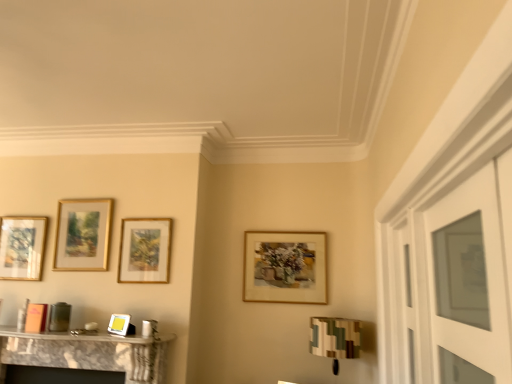
Question: From the image's perspective, is gold/glossy picture frame at upper left, positioned as the second picture frame in left-to-right order, above wooden picture frame at center, the 4th picture frame when ordered from left to right?

Choices:
 (A) no
 (B) yes

Answer: (B)

Question: Is gold/glossy picture frame at upper left, positioned as the second picture frame in left-to-right order, turned away from wooden picture frame at center, the first picture frame positioned from the right?

Choices:
 (A) yes
 (B) no

Answer: (B)

Question: Can you confirm if gold/glossy picture frame at upper left, positioned as the second picture frame in left-to-right order, is wider than wooden picture frame at center, the 4th picture frame when ordered from left to right?

Choices:
 (A) no
 (B) yes

Answer: (A)

Question: Does gold/glossy picture frame at upper left, which is the 3th picture frame from right to left, have a greater height compared to wooden picture frame at center, the first picture frame positioned from the right?

Choices:
 (A) yes
 (B) no

Answer: (B)

Question: Is gold/glossy picture frame at upper left, positioned as the second picture frame in left-to-right order, closer to the viewer compared to wooden picture frame at center, the 4th picture frame when ordered from left to right?

Choices:
 (A) no
 (B) yes

Answer: (B)

Question: Does point (404, 283) appear closer or farther from the camera than point (320, 342)?

Choices:
 (A) closer
 (B) farther

Answer: (A)

Question: Is clear glass door at right taller or shorter than camouflage fabric lampshade at lower right?

Choices:
 (A) short
 (B) tall

Answer: (B)

Question: From a real-world perspective, is clear glass door at right positioned above or below camouflage fabric lampshade at lower right?

Choices:
 (A) below
 (B) above

Answer: (B)

Question: In terms of size, does clear glass door at right appear bigger or smaller than camouflage fabric lampshade at lower right?

Choices:
 (A) big
 (B) small

Answer: (B)

Question: Is gold/glossy picture frame at upper left, positioned as the second picture frame in left-to-right order, wider or thinner than gold-framed picture at left, placed as the fourth picture frame when sorted from right to left?

Choices:
 (A) thin
 (B) wide

Answer: (A)

Question: From the image's perspective, relative to gold-framed picture at left, placed as the fourth picture frame when sorted from right to left, is gold/glossy picture frame at upper left, positioned as the second picture frame in left-to-right order, above or below?

Choices:
 (A) below
 (B) above

Answer: (B)

Question: Is gold/glossy picture frame at upper left, which is the 3th picture frame from right to left, to the left or to the right of gold-framed picture at left, which is the 1th picture frame in left-to-right order, in the image?

Choices:
 (A) right
 (B) left

Answer: (A)

Question: Considering the positions of point (99, 221) and point (0, 236), is point (99, 221) closer or farther from the camera than point (0, 236)?

Choices:
 (A) farther
 (B) closer

Answer: (B)

Question: From a real-world perspective, relative to clear glass door at right, is gold-framed picture at left, which is the 1th picture frame in left-to-right order, vertically above or below?

Choices:
 (A) below
 (B) above

Answer: (B)

Question: Do you think gold-framed picture at left, which is the 1th picture frame in left-to-right order, is within clear glass door at right, or outside of it?

Choices:
 (A) outside
 (B) inside

Answer: (A)